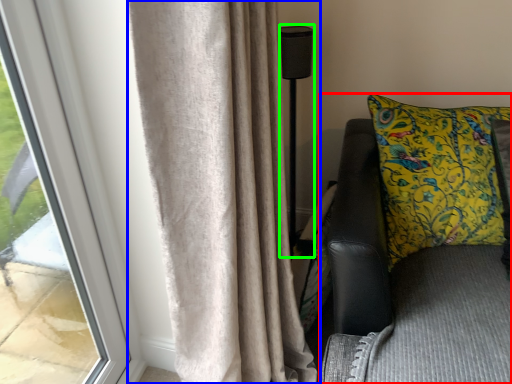
Question: Which is nearer to the furniture (highlighted by a red box)? curtain (highlighted by a blue box) or lamp (highlighted by a green box).

Choices:
 (A) curtain
 (B) lamp

Answer: (A)